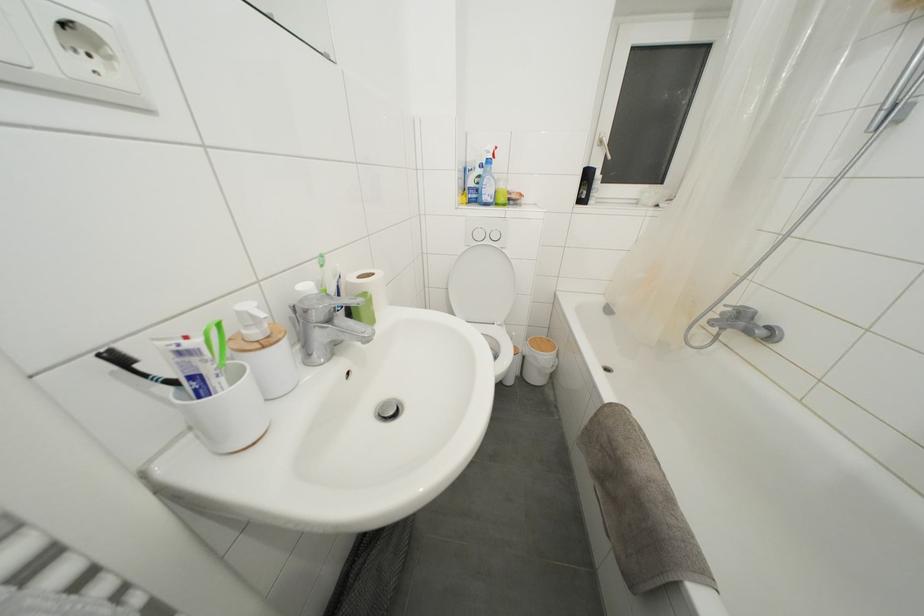
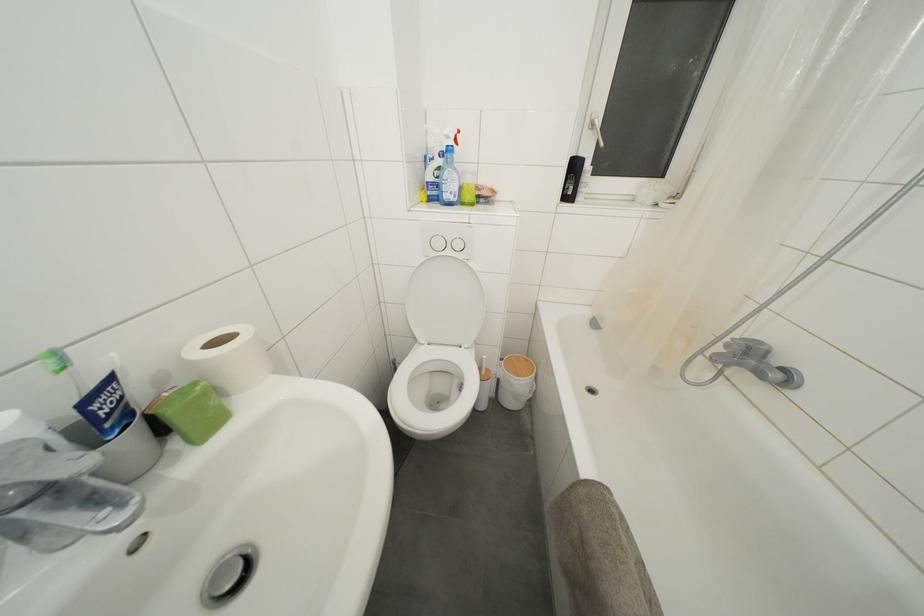
Question: I am providing you with two images of the same scene from different viewpoints. Please identify which objects are invisible in image2.

Choices:
 (A) white toilet lid
 (B) sink faucet handle
 (C) green bar soap
 (D) none of these

Answer: (D)